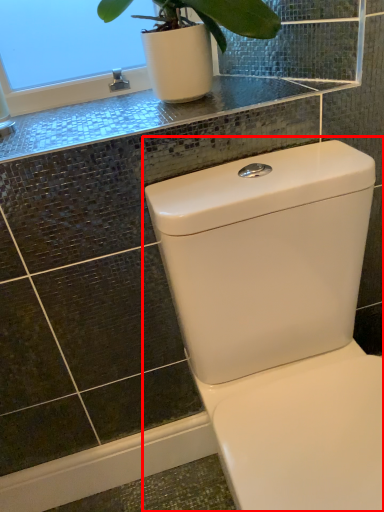
Question: Considering the relative positions of toilet (annotated by the red box) and counter top in the image provided, where is toilet (annotated by the red box) located with respect to the staircase?

Choices:
 (A) left
 (B) right

Answer: (B)